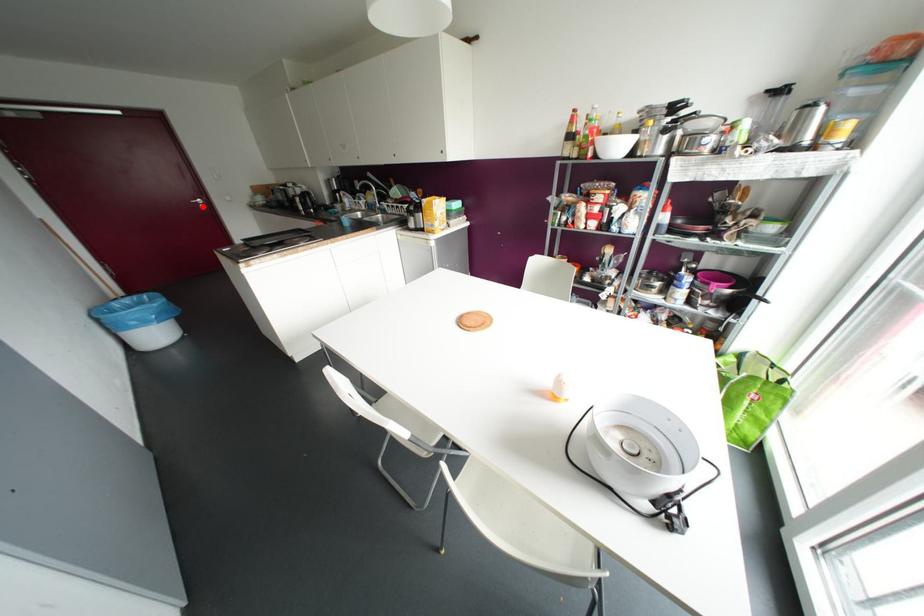
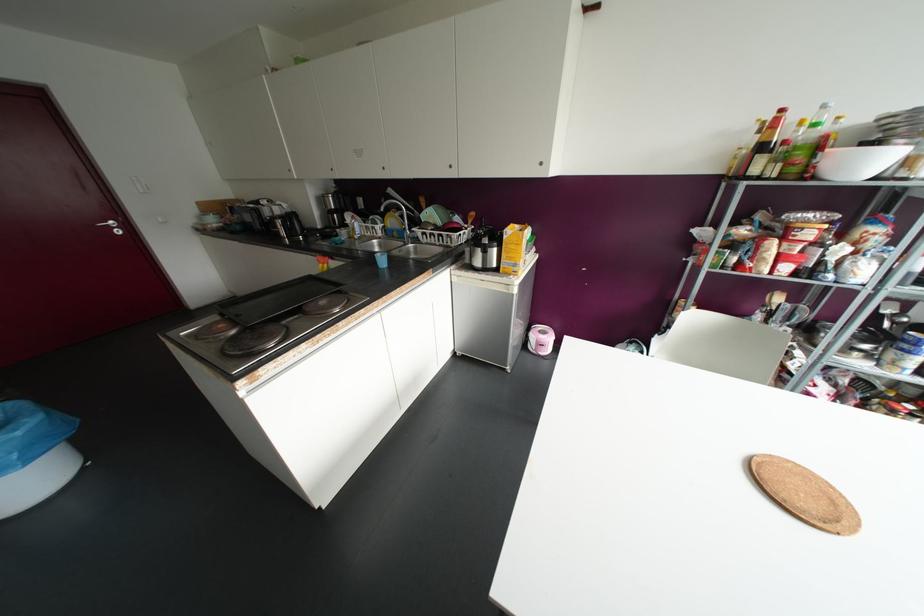
Locate, in the second image, the point that corresponds to the highlighted location in the first image.

(117, 232)